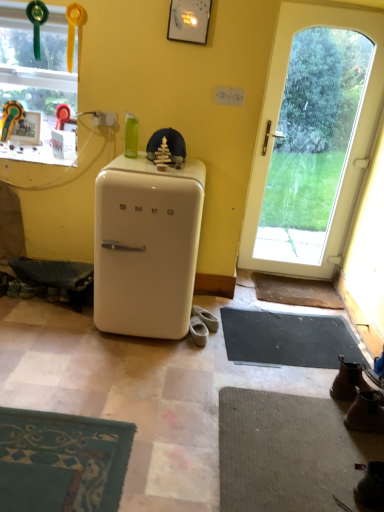
Question: Does brown leather boot at lower right, placed as the 1th footwear when sorted from front to back, touch beige suede shoes at lower center, the 2th footwear positioned from the front?

Choices:
 (A) yes
 (B) no

Answer: (B)

Question: Could you tell me if brown leather boot at lower right, placed as the 1th footwear when sorted from front to back, is facing beige suede shoes at lower center, the 2th footwear positioned from the front?

Choices:
 (A) no
 (B) yes

Answer: (A)

Question: Is brown leather boot at lower right, the third footwear positioned from the top, oriented away from beige suede shoes at lower center, the 2th footwear positioned from the front?

Choices:
 (A) yes
 (B) no

Answer: (B)

Question: Considering the relative sizes of brown leather boot at lower right, placed as the 1th footwear when sorted from front to back, and beige suede shoes at lower center, placed as the 1th footwear when sorted from left to right, in the image provided, is brown leather boot at lower right, placed as the 1th footwear when sorted from front to back, smaller than beige suede shoes at lower center, placed as the 1th footwear when sorted from left to right,?

Choices:
 (A) no
 (B) yes

Answer: (A)

Question: Is brown leather boot at lower right, the third footwear positioned from the top, surrounding beige suede shoes at lower center, the second footwear viewed from the back?

Choices:
 (A) yes
 (B) no

Answer: (B)

Question: Are brown leather boot at lower right, placed as the 1th footwear when sorted from front to back, and beige suede shoes at lower center, which is the 2th footwear from top to bottom, located far from each other?

Choices:
 (A) no
 (B) yes

Answer: (A)

Question: Is beige suede shoes at lower center, which is counted as the first footwear, starting from the top, shorter than black rubber yoga mat at lower right?

Choices:
 (A) yes
 (B) no

Answer: (B)

Question: Is beige suede shoes at lower center, which ranks as the third footwear in front-to-back order, looking in the opposite direction of black rubber yoga mat at lower right?

Choices:
 (A) no
 (B) yes

Answer: (A)

Question: From the image's perspective, is beige suede shoes at lower center, the third footwear positioned from the bottom, under black rubber yoga mat at lower right?

Choices:
 (A) yes
 (B) no

Answer: (B)

Question: Is black rubber yoga mat at lower right inside beige suede shoes at lower center, the third footwear positioned from the bottom?

Choices:
 (A) no
 (B) yes

Answer: (A)

Question: Is the depth of beige suede shoes at lower center, which is counted as the first footwear, starting from the top, less than that of black rubber yoga mat at lower right?

Choices:
 (A) yes
 (B) no

Answer: (B)

Question: Is beige suede shoes at lower center, the 2th footwear when ordered from right to left, with black rubber yoga mat at lower right?

Choices:
 (A) no
 (B) yes

Answer: (A)

Question: Is white glass door at right far away from transparent glass window at upper left?

Choices:
 (A) yes
 (B) no

Answer: (A)